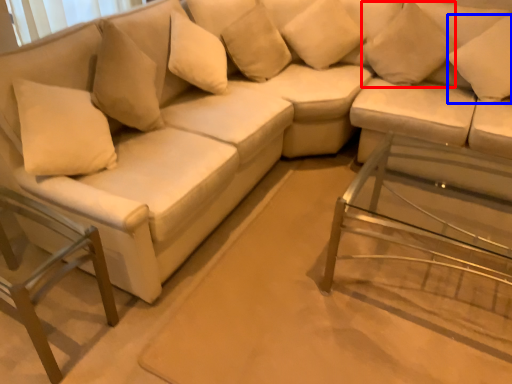
Question: Among these objects, which one is nearest to the camera, pillow (highlighted by a red box) or pillow (highlighted by a blue box)?

Choices:
 (A) pillow
 (B) pillow

Answer: (B)